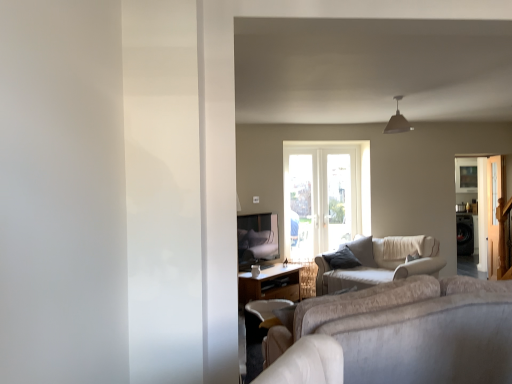
Question: Is metallic gray pendant light at upper center bigger or smaller than wooden table at center?

Choices:
 (A) big
 (B) small

Answer: (B)

Question: Visually, is metallic gray pendant light at upper center positioned to the left or to the right of wooden table at center?

Choices:
 (A) left
 (B) right

Answer: (B)

Question: Which object is positioned farthest from the metallic gray pendant light at upper center?

Choices:
 (A) wooden table at center
 (B) dark brown leather swivel chair at lower center
 (C) clear glass screen door at right, the second screen door from the back
 (D) beige fabric couch at center
 (E) metallic silver screen door at right, which is the 2th screen door in front-to-back order

Answer: (B)

Question: Which of these objects is positioned closest to the clear glass screen door at right, the second screen door from the back?

Choices:
 (A) dark brown leather swivel chair at lower center
 (B) metallic gray pendant light at upper center
 (C) wooden table at center
 (D) beige fabric couch at center
 (E) metallic silver screen door at right, which appears as the 1th screen door when viewed from the back

Answer: (E)